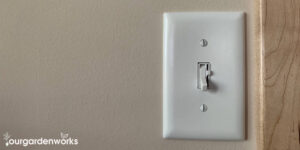
In order to click on screws in this screenshot , I will do `click(205, 43)`, `click(203, 108)`.